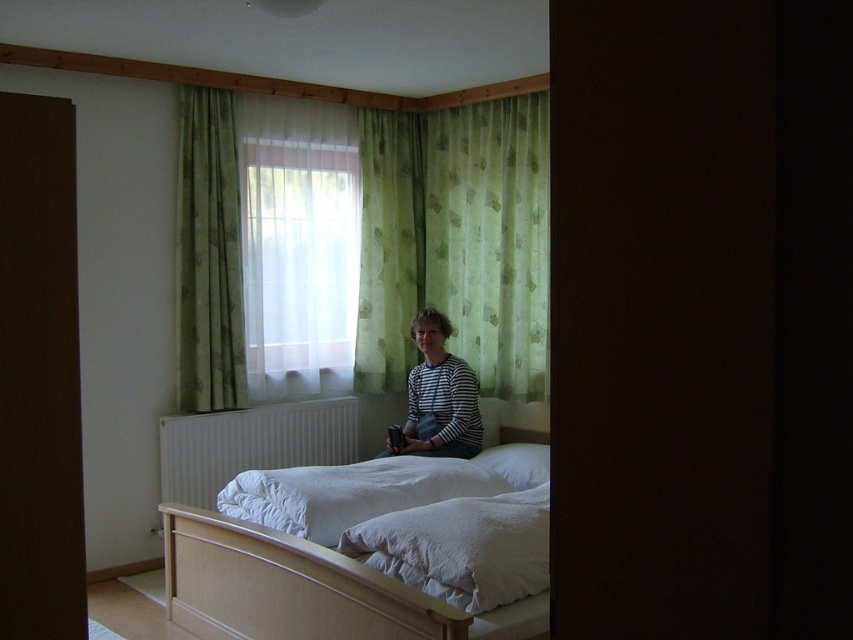
Question: Is white soft bed at center smaller than striped fabric at center?

Choices:
 (A) yes
 (B) no

Answer: (B)

Question: Is translucent fabric window at center below green floral fabric curtain at upper center?

Choices:
 (A) yes
 (B) no

Answer: (A)

Question: Which point appears closest to the camera in this image?

Choices:
 (A) (346, 561)
 (B) (445, 401)
 (C) (282, 413)

Answer: (A)

Question: Is green sheer curtains at upper center wider than green floral fabric curtain at upper center?

Choices:
 (A) no
 (B) yes

Answer: (B)

Question: Which point is closer to the camera?

Choices:
 (A) (218, 134)
 (B) (223, 456)
 (C) (384, 579)

Answer: (C)

Question: Which object is positioned farthest from the white metallic radiator at lower center?

Choices:
 (A) striped fabric at center
 (B) green floral fabric curtain at upper center
 (C) translucent fabric window at center

Answer: (A)